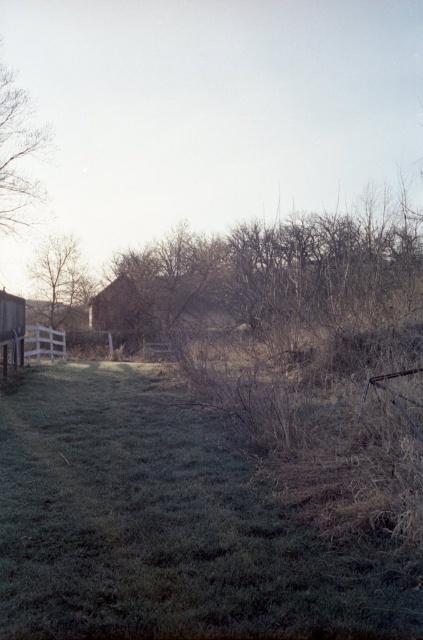
Question: Can you confirm if green grass at center is smaller than smooth brown tree at left?

Choices:
 (A) yes
 (B) no

Answer: (A)

Question: Which point is farther from the camera taking this photo?

Choices:
 (A) (30, 122)
 (B) (220, 492)

Answer: (A)

Question: Does green grass at center appear over smooth brown tree at left?

Choices:
 (A) yes
 (B) no

Answer: (B)

Question: Is green grass at center above smooth brown tree at left?

Choices:
 (A) no
 (B) yes

Answer: (A)